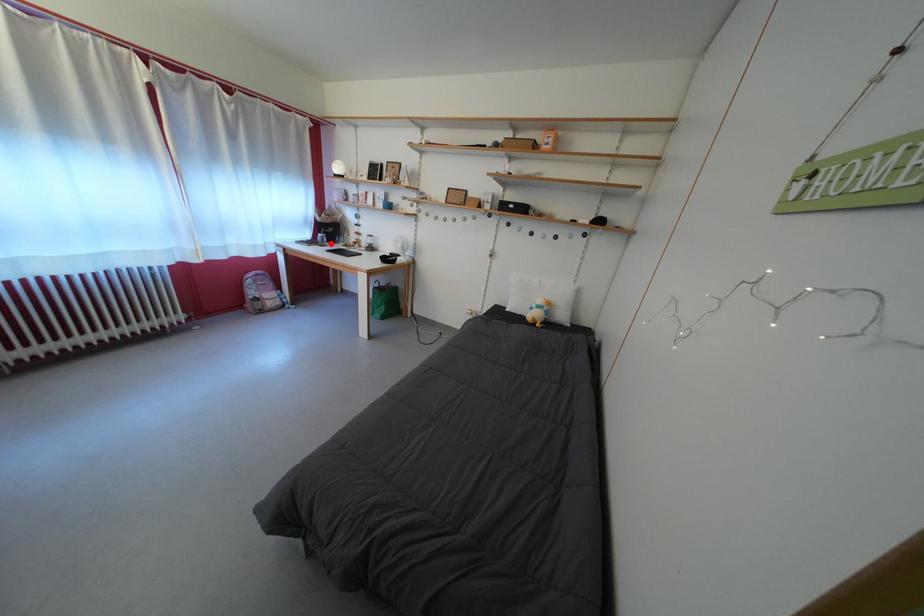
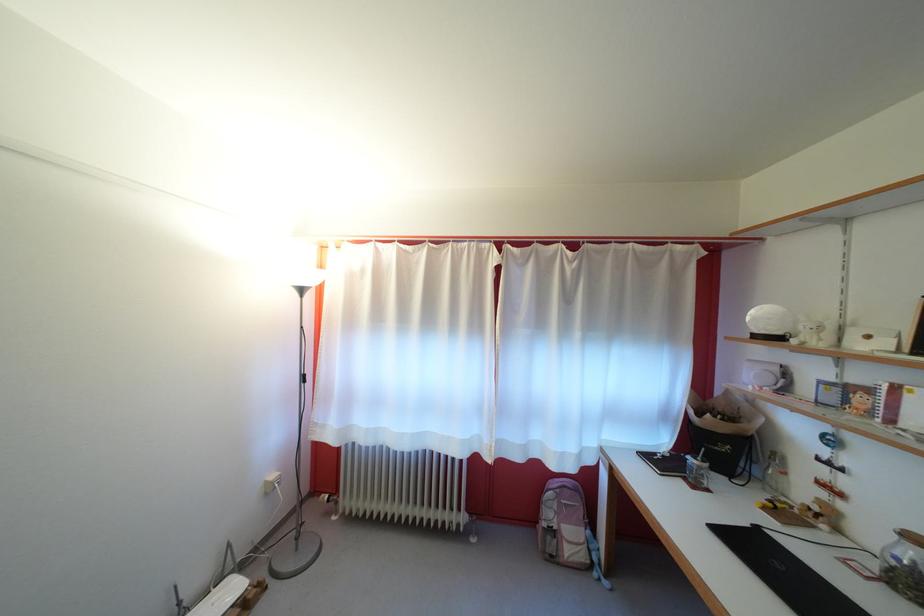
The point at the highlighted location is marked in the first image. Where is the corresponding point in the second image?

(708, 474)